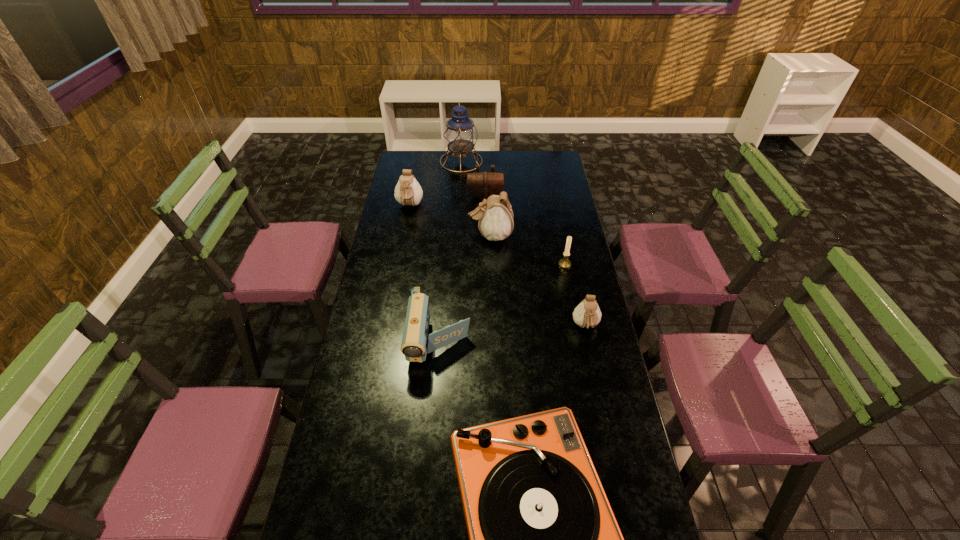
Find the location of a particular element. The height and width of the screenshot is (540, 960). object present at the far edge is located at coordinates (460, 134).

The image size is (960, 540). What are the coordinates of `object that is at the left edge` in the screenshot? It's located at coord(408,192).

Identify the location of candle holder that is at the right edge. (564, 263).

Image resolution: width=960 pixels, height=540 pixels. In order to click on pouch at the right edge in this screenshot , I will do `click(587, 314)`.

I want to click on free space at the far edge of the desktop, so click(x=504, y=156).

I want to click on free spot at the left edge of the desktop, so click(x=378, y=346).

In the image, there is a desktop. Find the location of `free region at the right edge`. free region at the right edge is located at coordinates (534, 174).

Locate an element on the screen. The width and height of the screenshot is (960, 540). free space at the far left corner of the desktop is located at coordinates (398, 166).

In the image, there is a desktop. Where is `vacant space at the far right corner`? Image resolution: width=960 pixels, height=540 pixels. vacant space at the far right corner is located at coordinates (548, 153).

What are the coordinates of `vacant area that lies between the camcorder and the brown pouch` in the screenshot? It's located at (463, 269).